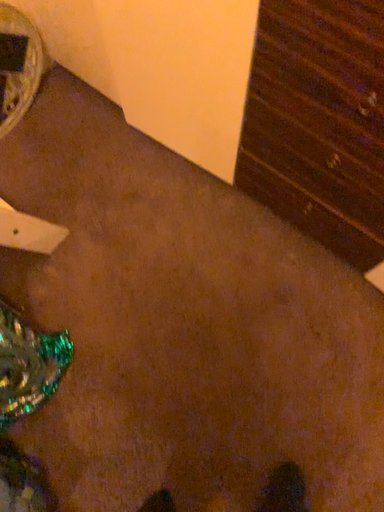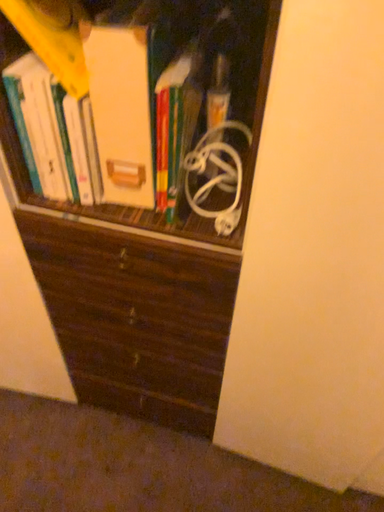
Question: Which way did the camera rotate in the video?

Choices:
 (A) rotated upward
 (B) rotated downward

Answer: (A)